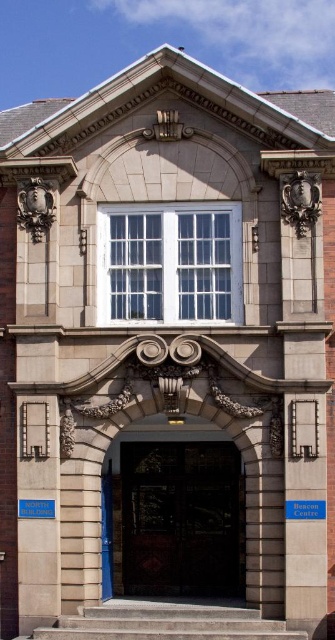
Based on the photo, you are a delivery person trying to enter the North Building. You need to locate the entrance. Which object should you approach first, the dark wood door at center or the concrete stairs at center?

The dark wood door at center is the entrance, so you should approach the dark wood door at center first.

You are standing at the entrance of the North Building and want to locate the dark wood door at center. According to the coordinates provided, where would you look relative to the blue sign on the left side of the entrance?

The dark wood door at center is located at coordinates point [181,518], which would be to the right of the blue sign on the left side of the entrance.

You are a visitor arriving at the North Building entrance. You see a dark wood door at center and a concrete stairs at center. Which one is more to the left side?

The dark wood door at center is more to the left side.